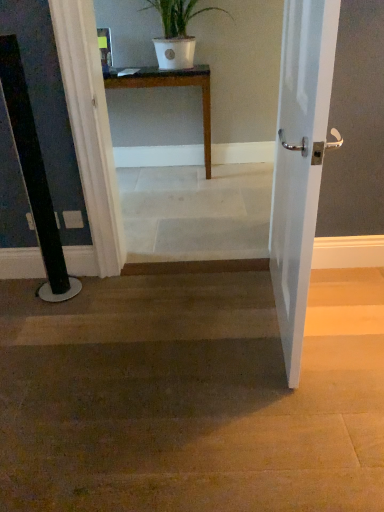
Question: From a real-world perspective, is wooden table at center physically located above or below white glossy door at right?

Choices:
 (A) above
 (B) below

Answer: (B)

Question: Would you say wooden table at center is to the left or to the right of white glossy door at right in the picture?

Choices:
 (A) left
 (B) right

Answer: (A)

Question: Which of these objects is positioned closest to the white matte pot at upper center?

Choices:
 (A) white glossy door at right
 (B) brown wood floor at center
 (C) wooden table at center
 (D) white marble stairs at center

Answer: (C)

Question: Which object is positioned farthest from the brown wood floor at center?

Choices:
 (A) white marble stairs at center
 (B) white matte pot at upper center
 (C) white glossy door at right
 (D) wooden table at center

Answer: (A)